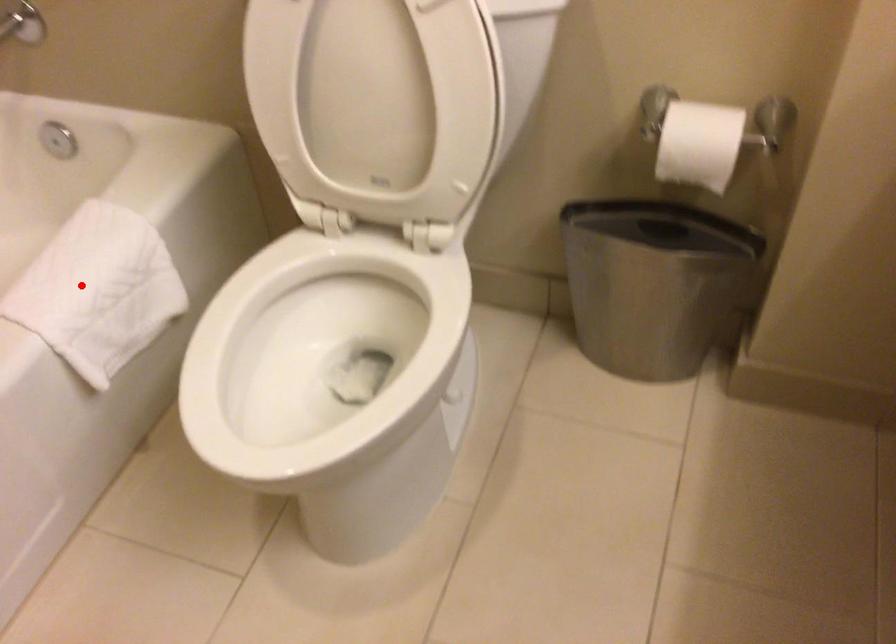
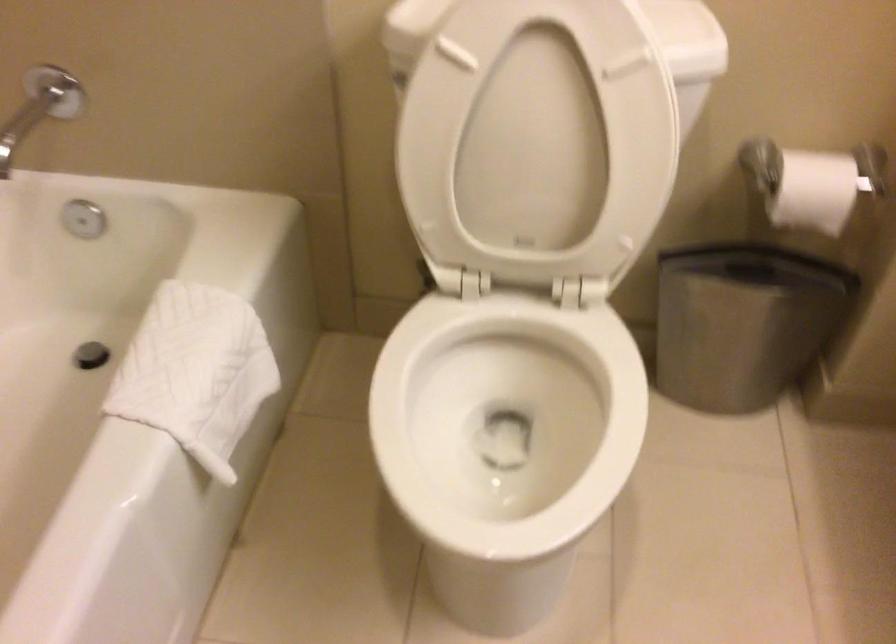
Find the pixel in the second image that matches the highlighted location in the first image.

(195, 372)